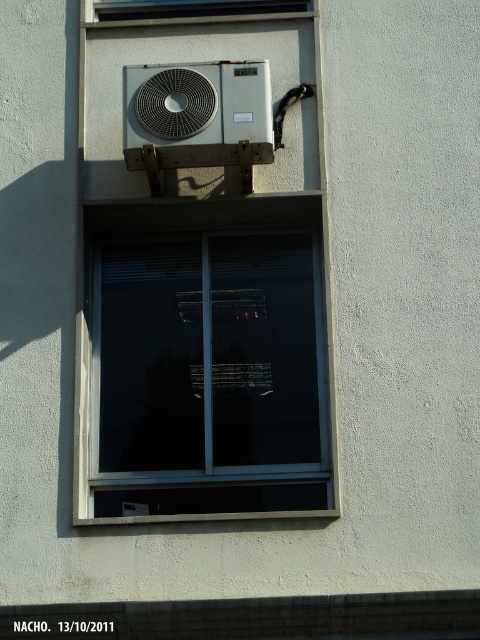
Between transparent glass window at center and transparent glass window at upper center, which one is positioned lower?

Positioned lower is transparent glass window at center.

Which of these two, transparent glass window at center or transparent glass window at upper center, stands shorter?

transparent glass window at upper center is shorter.

Is point (156, 416) closer to camera compared to point (172, 0)?

That is True.

I want to click on transparent glass window at center, so click(206, 362).

Is point (259, 490) positioned behind point (264, 61)?

No, it is not.

Is transparent glass window at center taller than silver metallic air conditioner at upper center?

Correct, transparent glass window at center is much taller as silver metallic air conditioner at upper center.

Find the location of a particular element. transparent glass window at center is located at coordinates (206, 362).

Is silver metallic air conditioner at upper center bigger than transparent glass window at upper center?

Yes.

Can you confirm if silver metallic air conditioner at upper center is smaller than transparent glass window at upper center?

Actually, silver metallic air conditioner at upper center might be larger than transparent glass window at upper center.

You are a GUI agent. You are given a task and a screenshot of the screen. Output one action in this format:
    pyautogui.click(x=<x>, y=<y>)
    Task: Click on the silver metallic air conditioner at upper center
    The height and width of the screenshot is (640, 480).
    Given the screenshot: What is the action you would take?
    pyautogui.click(x=197, y=113)

This screenshot has width=480, height=640. In order to click on silver metallic air conditioner at upper center in this screenshot , I will do `click(197, 113)`.